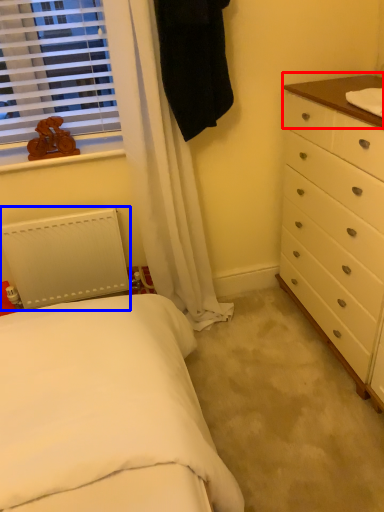
Question: Which object is closer to the camera taking this photo, counter top (highlighted by a red box) or radiator (highlighted by a blue box)?

Choices:
 (A) counter top
 (B) radiator

Answer: (A)